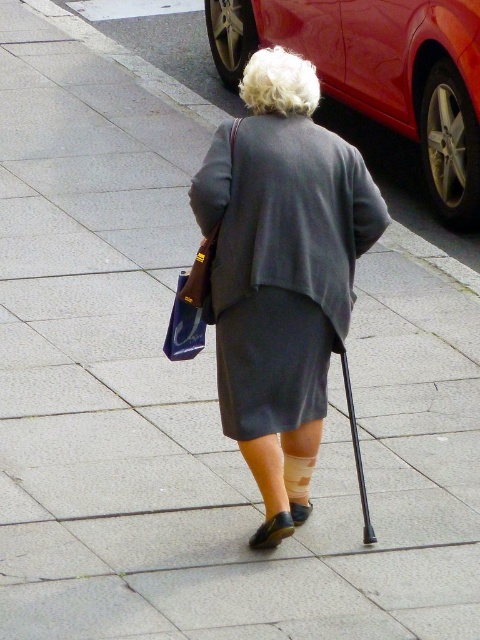
Question: Considering the relative positions of gray matte coat at center and shiny red car at upper right in the image provided, where is gray matte coat at center located with respect to shiny red car at upper right?

Choices:
 (A) below
 (B) above

Answer: (A)

Question: Which object appears closest to the camera in this image?

Choices:
 (A) blue fabric bag at center
 (B) gray matte coat at center

Answer: (A)

Question: From the image, what is the correct spatial relationship of gray matte coat at center in relation to shiny red car at upper right?

Choices:
 (A) right
 (B) left

Answer: (B)

Question: Among these objects, which one is farthest from the camera?

Choices:
 (A) gray matte coat at center
 (B) shiny red car at upper right
 (C) blue fabric bag at center

Answer: (B)

Question: Which object is closer to the camera taking this photo?

Choices:
 (A) shiny red car at upper right
 (B) blue fabric bag at center
 (C) gray matte coat at center

Answer: (B)

Question: Is gray matte coat at center smaller than shiny red car at upper right?

Choices:
 (A) no
 (B) yes

Answer: (B)